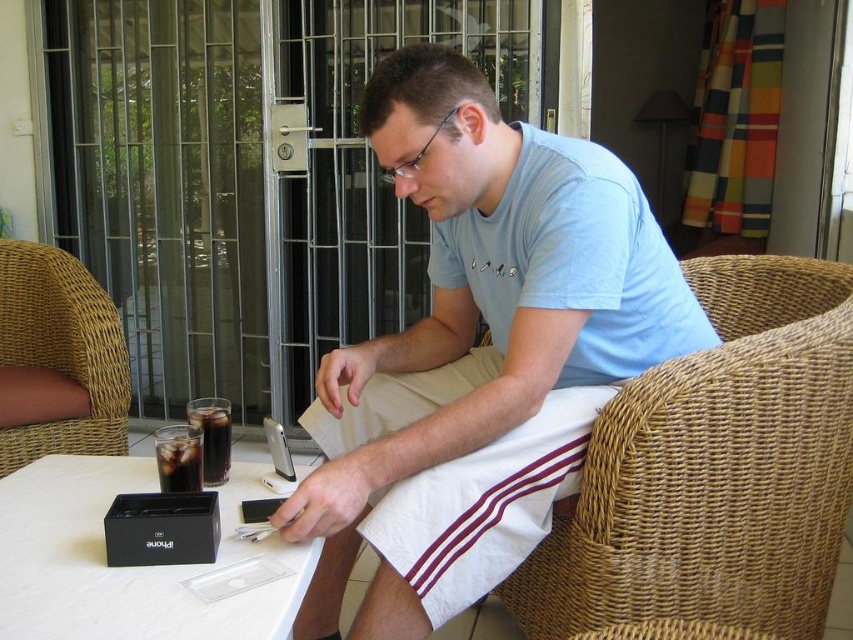
You are a delivery person who needs to place a small package on the table without spilling the cola. Given the distance between the black plastic table at lower left and the dark glass cola at table left, can you safely place the package there?

The black plastic table at lower left and dark glass cola at table left are 6.04 inches apart. Since the package is small, you can safely place it in the available space between them without disturbing the cola.

You are a delivery person who needs to place a small package on the table. The package is 10 cm in width. You see the brown wicker chair at left and the dark glass beverage at table left. Which item on the table do you need to move to make space for the package?

The dark glass beverage at table left is narrower than the brown wicker chair at left, so you should move the dark glass beverage at table left to make space for the package.